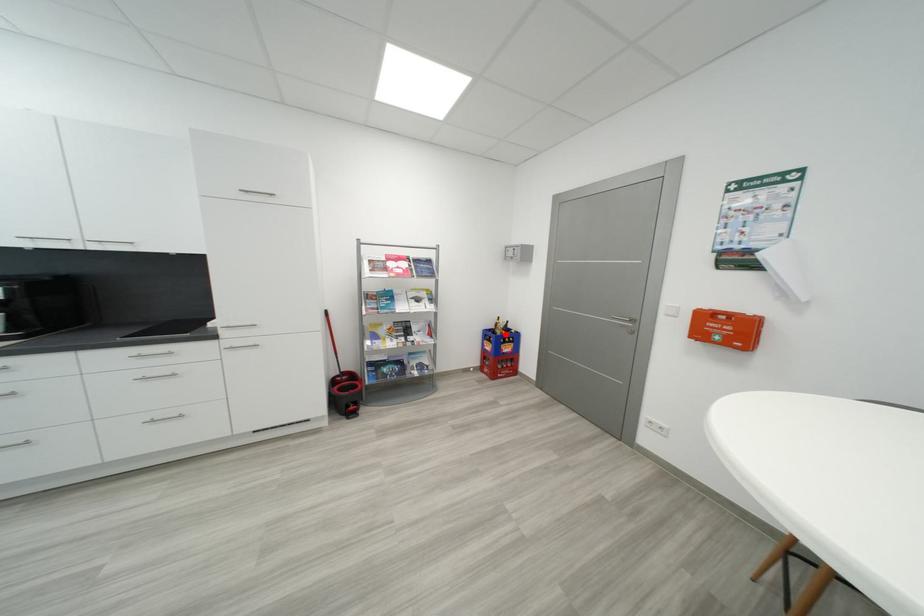
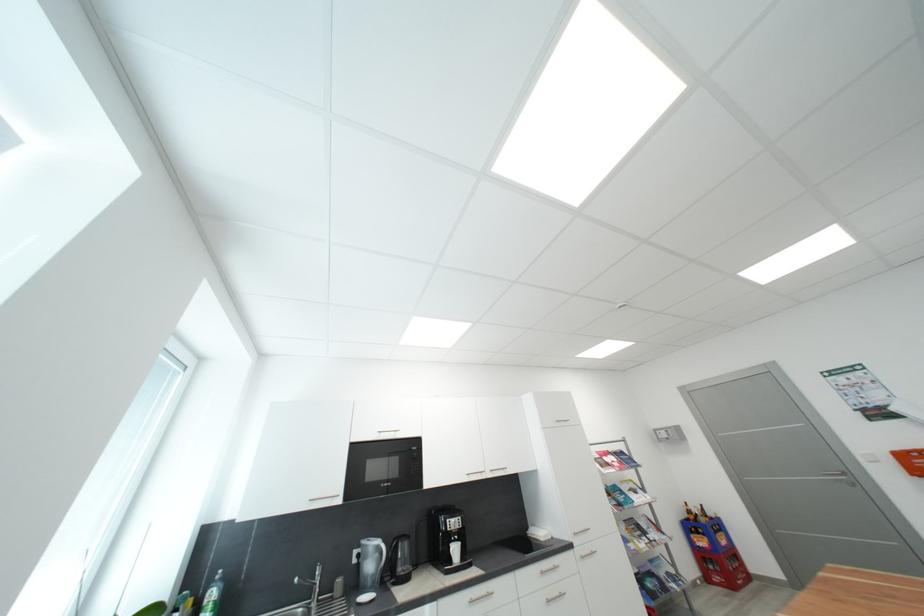
Question: A red point is marked in image1. In image2, is the corresponding 3D point closer to the camera or farther? Reply with the corresponding letter.

Choices:
 (A) The corresponding 3D point is closer.
 (B) The corresponding 3D point is farther.

Answer: (A)